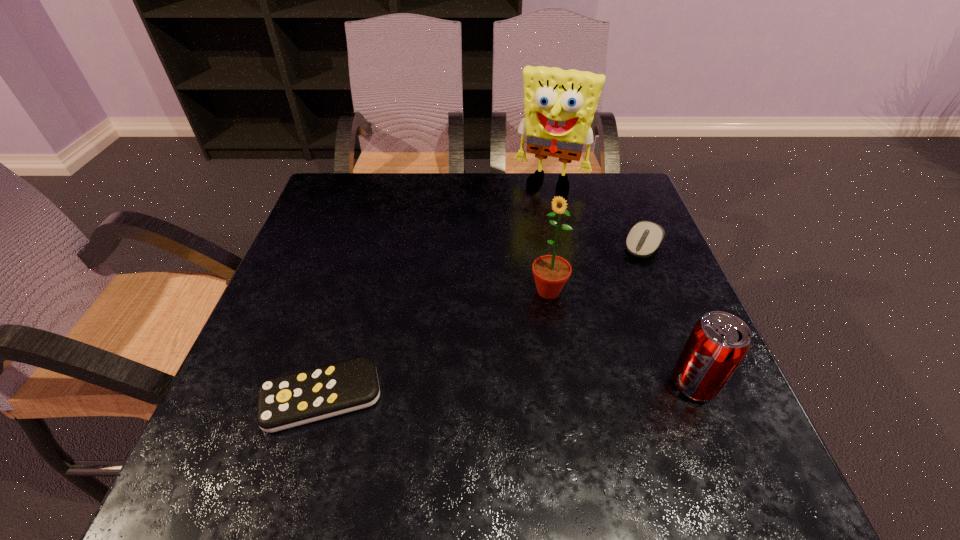
I want to click on free space at the far edge, so click(x=556, y=174).

In the image, there is a desktop. Where is `free space at the near edge`? free space at the near edge is located at coordinates (409, 413).

Where is `free space at the left edge of the desktop`? Image resolution: width=960 pixels, height=540 pixels. free space at the left edge of the desktop is located at coordinates point(296,295).

What are the coordinates of `vacant area at the right edge` in the screenshot? It's located at (610, 283).

At what (x,y) coordinates should I click in order to perform the action: click on vacant position at the far left corner of the desktop. Please return your answer as a coordinate pair (x, y). This screenshot has width=960, height=540. Looking at the image, I should click on (338, 200).

In the image, there is a desktop. At what (x,y) coordinates should I click in order to perform the action: click on vacant space at the far right corner. Please return your answer as a coordinate pair (x, y). This screenshot has height=540, width=960. Looking at the image, I should click on (612, 194).

The height and width of the screenshot is (540, 960). Identify the location of free spot between the computer equipment and the remote control. (482, 321).

At what (x,y) coordinates should I click in order to perform the action: click on free space that is in between the fourth nearest object and the soda can. Please return your answer as a coordinate pair (x, y). Image resolution: width=960 pixels, height=540 pixels. Looking at the image, I should click on (668, 315).

This screenshot has height=540, width=960. What are the coordinates of `free area in between the fourth shortest object and the third tallest object` in the screenshot? It's located at pos(621,338).

Find the location of a particular element. vacant area that lies between the third tallest object and the computer equipment is located at coordinates (668, 315).